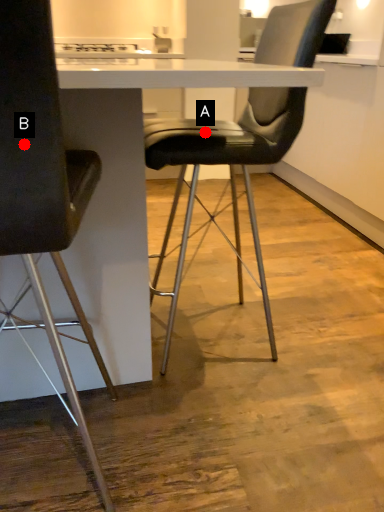
Question: Two points are circled on the image, labeled by A and B beside each circle. Which point appears closest to the camera in this image?

Choices:
 (A) A is closer
 (B) B is closer

Answer: (B)